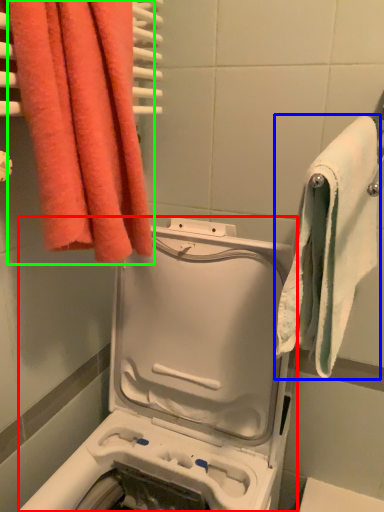
Question: Which object is positioned farthest from washing machine (highlighted by a red box)? Select from towel (highlighted by a blue box) and towel (highlighted by a green box).

Choices:
 (A) towel
 (B) towel

Answer: (B)